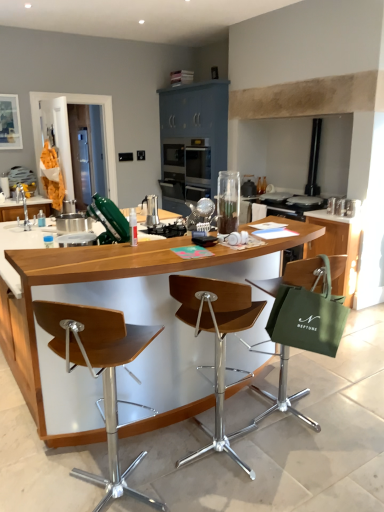
Describe the element at coordinates (192, 141) in the screenshot. I see `matte blue cabinet at center, positioned as the 1th cabinetry in top-to-bottom order` at that location.

Measure the distance between wooden seat at center, marked as the 2th chair in a right-to-left arrangement, and camera.

wooden seat at center, marked as the 2th chair in a right-to-left arrangement, is 1.87 meters away from camera.

The height and width of the screenshot is (512, 384). What are the coordinates of `green fabric bag at right, which is the 2th cabinetry in left-to-right order` in the screenshot? It's located at (337, 247).

At what (x,y) coordinates should I click in order to perform the action: click on cabinetry that is under the satin silver coffee maker at center (from a real-world perspective). Please return your answer as a coordinate pair (x, y). Looking at the image, I should click on (337, 247).

From a real-world perspective, does green fabric bag at right, the second cabinetry viewed from the back, stand above satin silver coffee maker at center?

No.

Which object is wider, green fabric bag at right, arranged as the first cabinetry when viewed from the right, or satin silver coffee maker at center?

Wider between the two is green fabric bag at right, arranged as the first cabinetry when viewed from the right.

Is green fabric bag at right, the first cabinetry when ordered from front to back, taller than satin silver coffee maker at center?

Yes, green fabric bag at right, the first cabinetry when ordered from front to back, is taller than satin silver coffee maker at center.

From a real-world perspective, does green fabric shopping bag at right sit lower than satin silver coffee maker at center?

Yes.

Does green fabric shopping bag at right turn towards satin silver coffee maker at center?

No, green fabric shopping bag at right is not facing towards satin silver coffee maker at center.

Find the location of `shopping bag lying in front of the satin silver coffee maker at center`. shopping bag lying in front of the satin silver coffee maker at center is located at coordinates (308, 309).

Is satin silver coffee maker at center a part of green fabric shopping bag at right?

Definitely not — satin silver coffee maker at center is not inside green fabric shopping bag at right.

Does wooden seat at center, marked as the 2th chair in a right-to-left arrangement, lie behind wooden seat at center, the 1th chair positioned from the left?

Yes, wooden seat at center, marked as the 2th chair in a right-to-left arrangement, is behind wooden seat at center, the 1th chair positioned from the left.

Considering the relative sizes of wooden seat at center, which appears as the 2th chair when viewed from the left, and wooden seat at center, the 1th chair positioned from the left, in the image provided, is wooden seat at center, which appears as the 2th chair when viewed from the left, bigger than wooden seat at center, the 1th chair positioned from the left,?

Incorrect, wooden seat at center, which appears as the 2th chair when viewed from the left, is not larger than wooden seat at center, the 1th chair positioned from the left.

From the picture: Which is more to the right, wooden seat at center, marked as the 2th chair in a right-to-left arrangement, or wooden seat at center, the 1th chair positioned from the left?

Positioned to the right is wooden seat at center, marked as the 2th chair in a right-to-left arrangement.

From the image's perspective, who appears lower, wooden seat at center, marked as the 2th chair in a right-to-left arrangement, or wooden seat at center, the 1th chair positioned from the left?

wooden seat at center, the 1th chair positioned from the left, is shown below in the image.

From a real-world perspective, is wooden seat at center, which is the 3th chair from right to left, physically located above or below wooden seat at center, which appears as the 2th chair when viewed from the left?

In terms of real-world spatial position, wooden seat at center, which is the 3th chair from right to left, is below wooden seat at center, which appears as the 2th chair when viewed from the left.

Is wooden seat at center, which is the 3th chair from right to left, outside of wooden seat at center, which appears as the 2th chair when viewed from the left?

That's correct, wooden seat at center, which is the 3th chair from right to left, is outside of wooden seat at center, which appears as the 2th chair when viewed from the left.

What's the angular difference between wooden seat at center, the 1th chair positioned from the left, and wooden seat at center, marked as the 2th chair in a right-to-left arrangement,'s facing directions?

There is a 1.73-degree angle between the facing directions of wooden seat at center, the 1th chair positioned from the left, and wooden seat at center, marked as the 2th chair in a right-to-left arrangement.

Does wooden seat at center, the 1th chair positioned from the left, have a larger size compared to wooden seat at center, which appears as the 2th chair when viewed from the left?

Yes, wooden seat at center, the 1th chair positioned from the left, is bigger than wooden seat at center, which appears as the 2th chair when viewed from the left.

Is wooden seat at center, which appears as the 2th chair when viewed from the left, not near wooden table at center?

No, there isn't a large distance between wooden seat at center, which appears as the 2th chair when viewed from the left, and wooden table at center.

Between wooden seat at center, marked as the 2th chair in a right-to-left arrangement, and wooden table at center, which one has smaller width?

wooden seat at center, marked as the 2th chair in a right-to-left arrangement.

From a real-world perspective, which object rests below the other?

In real-world perspective, wooden seat at center, marked as the 2th chair in a right-to-left arrangement, is lower.

Which is behind, point (221, 412) or point (27, 375)?

Positioned behind is point (27, 375).

Who is more distant, green fabric bag at right, the second cabinetry viewed from the back, or green fabric shopping bag at right?

Positioned behind is green fabric bag at right, the second cabinetry viewed from the back.

Does green fabric bag at right, arranged as the first cabinetry when viewed from the right, have a larger size compared to green fabric shopping bag at right?

Correct, green fabric bag at right, arranged as the first cabinetry when viewed from the right, is larger in size than green fabric shopping bag at right.

From a real-world perspective, which object stands above the other?

green fabric shopping bag at right, from a real-world perspective.

Between green fabric chair at right, which ranks as the 3th chair in left-to-right order, and wooden table at center, which one has larger size?

wooden table at center.

Is the depth of green fabric chair at right, the first chair when ordered from right to left, less than that of wooden table at center?

No, green fabric chair at right, the first chair when ordered from right to left, is further to the viewer.

From the image's perspective, is green fabric chair at right, which ranks as the 3th chair in left-to-right order, above or below wooden table at center?

Based on their image positions, green fabric chair at right, which ranks as the 3th chair in left-to-right order, is located beneath wooden table at center.

In the scene shown: Which is more to the right, green fabric chair at right, the first chair when ordered from right to left, or wooden table at center?

green fabric chair at right, the first chair when ordered from right to left, is more to the right.

Find the location of a particular element. The image size is (384, 512). appliance that is above the green fabric bag at right, which is counted as the second cabinetry, starting from the top (from a real-world perspective) is located at coordinates (151, 210).

You are a GUI agent. You are given a task and a screenshot of the screen. Output one action in this format:
    pyautogui.click(x=<x>, y=<y>)
    Task: Click on the appliance above the green fabric shopping bag at right (from the image's perspective)
    This screenshot has height=512, width=384.
    Given the screenshot: What is the action you would take?
    pyautogui.click(x=151, y=210)

Which object lies nearer to the anchor point matte blue cabinet at center, marked as the 2th cabinetry in a front-to-back arrangement, green fabric shopping bag at right or wooden table at center?

The object closer to matte blue cabinet at center, marked as the 2th cabinetry in a front-to-back arrangement, is wooden table at center.

Based on their spatial positions, is green fabric bag at right, the second cabinetry viewed from the back, or green fabric chair at right, the first chair when ordered from right to left, closer to satin silver coffee maker at center?

green fabric bag at right, the second cabinetry viewed from the back.

Looking at the image, which one is located closer to wooden table at center, green fabric chair at right, which ranks as the 3th chair in left-to-right order, or satin silver coffee maker at center?

green fabric chair at right, which ranks as the 3th chair in left-to-right order.

Which object lies further to the anchor point satin silver coffee maker at center, green fabric shopping bag at right or matte blue cabinet at center, which appears as the 2th cabinetry when ordered from the bottom?

matte blue cabinet at center, which appears as the 2th cabinetry when ordered from the bottom.

Based on the photo, when comparing their distances from green fabric shopping bag at right, does matte blue cabinet at center, which is counted as the first cabinetry, starting from the back, or wooden table at center seem further?

The object further to green fabric shopping bag at right is matte blue cabinet at center, which is counted as the first cabinetry, starting from the back.

Considering their positions, is matte blue cabinet at center, marked as the 2th cabinetry in a front-to-back arrangement, positioned further to green fabric chair at right, the first chair when ordered from right to left, than wooden seat at center, which is the 3th chair from right to left?

Based on the image, matte blue cabinet at center, marked as the 2th cabinetry in a front-to-back arrangement, appears to be further to green fabric chair at right, the first chair when ordered from right to left.

Considering their positions, is wooden seat at center, marked as the 2th chair in a right-to-left arrangement, positioned closer to matte blue cabinet at center, which appears as the first cabinetry when viewed from the left, than satin silver coffee maker at center?

satin silver coffee maker at center lies closer to matte blue cabinet at center, which appears as the first cabinetry when viewed from the left, than the other object.

Estimate the real-world distances between objects in this image. Which object is closer to wooden table at center, satin silver coffee maker at center or green fabric bag at right, arranged as the first cabinetry when viewed from the right?

The object closer to wooden table at center is satin silver coffee maker at center.

At what (x,y) coordinates should I click in order to perform the action: click on shopping bag located between wooden seat at center, which is the 3th chair from right to left, and green fabric bag at right, the second cabinetry viewed from the back, in the depth direction. Please return your answer as a coordinate pair (x, y). Looking at the image, I should click on (308, 309).

At what (x,y) coordinates should I click in order to perform the action: click on appliance positioned between wooden table at center and matte blue cabinet at center, which appears as the 2th cabinetry when ordered from the bottom, from near to far. Please return your answer as a coordinate pair (x, y). Looking at the image, I should click on (151, 210).

Locate an element on the screen. The width and height of the screenshot is (384, 512). chair located between green fabric shopping bag at right and green fabric bag at right, which is counted as the second cabinetry, starting from the top, in the depth direction is located at coordinates (303, 320).

At what (x,y) coordinates should I click in order to perform the action: click on shopping bag positioned between wooden table at center and green fabric bag at right, the first cabinetry when ordered from front to back, from near to far. Please return your answer as a coordinate pair (x, y). This screenshot has width=384, height=512. Looking at the image, I should click on (308, 309).